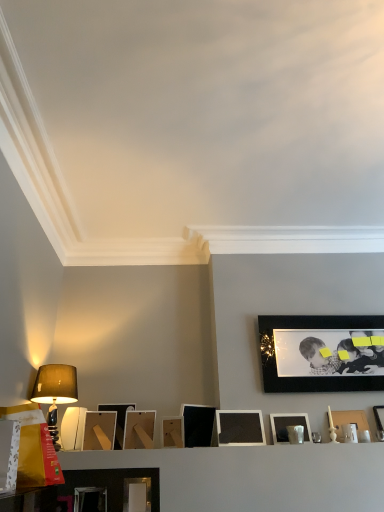
What is the approximate width of matte black picture frame at center, the 6th picture frame positioned from the right?

The width of matte black picture frame at center, the 6th picture frame positioned from the right, is 4.94 inches.

Describe the element at coordinates (198, 425) in the screenshot. I see `matte black picture frame at center, which is counted as the 8th picture frame, starting from the left` at that location.

The image size is (384, 512). What do you see at coordinates (379, 421) in the screenshot?
I see `matte black picture frame at right, which ranks as the 13th picture frame in left-to-right order` at bounding box center [379, 421].

The image size is (384, 512). What are the coordinates of `matte black picture frame at center, which ranks as the fourth picture frame in right-to-left order` in the screenshot? It's located at (288, 425).

Identify the location of black matte picture frame at upper right, the 11th picture frame in the left-to-right sequence. (319, 354).

Identify the location of matte brown picture frame at lower center, which is the third picture frame from left to right. (99, 430).

You are a GUI agent. You are given a task and a screenshot of the screen. Output one action in this format:
    pyautogui.click(x=<x>, y=<y>)
    Task: Click on the white matte picture frame at center, the fifth picture frame viewed from the right
    This screenshot has width=384, height=512.
    Given the screenshot: What is the action you would take?
    pyautogui.click(x=240, y=428)

The height and width of the screenshot is (512, 384). Describe the element at coordinates (240, 428) in the screenshot. I see `white matte picture frame at center, the fifth picture frame viewed from the right` at that location.

Find the location of a particular element. matte black picture frame at center, the 6th picture frame positioned from the right is located at coordinates (198, 425).

Is matte black picture frame at lower center, marked as the 2th picture frame in a left-to-right arrangement, situated inside matte white picture frame at right, placed as the 12th picture frame when sorted from left to right, or outside?

The correct answer is: outside.

In the scene shown: Could you tell me if matte black picture frame at lower center, which is the twelfth picture frame in right-to-left order, is facing matte white picture frame at right, the second picture frame from the right?

No, matte black picture frame at lower center, which is the twelfth picture frame in right-to-left order, does not turn towards matte white picture frame at right, the second picture frame from the right.

Does matte black picture frame at lower center, which is the twelfth picture frame in right-to-left order, lie in front of matte white picture frame at right, placed as the 12th picture frame when sorted from left to right?

Yes, it is in front of matte white picture frame at right, placed as the 12th picture frame when sorted from left to right.

Considering the sizes of objects matte black picture frame at lower center, which is the twelfth picture frame in right-to-left order, and matte white picture frame at right, placed as the 12th picture frame when sorted from left to right, in the image provided, who is smaller, matte black picture frame at lower center, which is the twelfth picture frame in right-to-left order, or matte white picture frame at right, placed as the 12th picture frame when sorted from left to right,?

Smaller between the two is matte black picture frame at lower center, which is the twelfth picture frame in right-to-left order.

From the image's perspective, who appears lower, matte wooden picture frame at center, which is the 9th picture frame from right to left, or matte silver picture frame at lower center, the eighth picture frame from the right?

From the image's view, matte silver picture frame at lower center, the eighth picture frame from the right, is below.

Could you tell me if matte wooden picture frame at center, which ranks as the fifth picture frame in left-to-right order, is facing matte silver picture frame at lower center, which ranks as the 6th picture frame in left-to-right order?

No, matte wooden picture frame at center, which ranks as the fifth picture frame in left-to-right order, is not turned towards matte silver picture frame at lower center, which ranks as the 6th picture frame in left-to-right order.

Between matte wooden picture frame at center, which ranks as the fifth picture frame in left-to-right order, and matte silver picture frame at lower center, the eighth picture frame from the right, which one has larger size?

matte wooden picture frame at center, which ranks as the fifth picture frame in left-to-right order, is bigger.

In the scene shown: Which is nearer, [132,442] or [127,510]?

Point [127,510]

From the image's perspective, is black matte picture frame at upper right, the 11th picture frame in the left-to-right sequence, beneath matte wooden picture frame at center, which ranks as the fifth picture frame in left-to-right order?

No.

From a real-world perspective, is black matte picture frame at upper right, the 11th picture frame in the left-to-right sequence, above or below matte wooden picture frame at center, which ranks as the fifth picture frame in left-to-right order?

black matte picture frame at upper right, the 11th picture frame in the left-to-right sequence, is above matte wooden picture frame at center, which ranks as the fifth picture frame in left-to-right order.

Looking at this image, is the surface of black matte picture frame at upper right, the 11th picture frame in the left-to-right sequence, in direct contact with matte wooden picture frame at center, which ranks as the fifth picture frame in left-to-right order?

They are not placed beside each other.

Between black matte picture frame at upper right, arranged as the 3th picture frame when viewed from the right, and matte wooden picture frame at center, which ranks as the fifth picture frame in left-to-right order, which one appears on the left side from the viewer's perspective?

From the viewer's perspective, matte wooden picture frame at center, which ranks as the fifth picture frame in left-to-right order, appears more on the left side.

Is matte wooden picture frame at center, which ranks as the fifth picture frame in left-to-right order, facing towards white matte picture frame at center, the fourth picture frame positioned from the left?

Yes, matte wooden picture frame at center, which ranks as the fifth picture frame in left-to-right order, is oriented towards white matte picture frame at center, the fourth picture frame positioned from the left.

Considering the relative sizes of matte wooden picture frame at center, which is the 9th picture frame from right to left, and white matte picture frame at center, the tenth picture frame in the right-to-left sequence, in the image provided, is matte wooden picture frame at center, which is the 9th picture frame from right to left, shorter than white matte picture frame at center, the tenth picture frame in the right-to-left sequence,?

Yes.

Which object is more forward, matte wooden picture frame at center, which is the 9th picture frame from right to left, or white matte picture frame at center, the tenth picture frame in the right-to-left sequence?

matte wooden picture frame at center, which is the 9th picture frame from right to left, is closer to the camera.

Between point (380, 365) and point (340, 418), which one is positioned in front?

The point (340, 418) is closer to the camera.

From a real-world perspective, count 8th picture frames upward from the matte white picture frame at right, placed as the 12th picture frame when sorted from left to right, and point to it. Please provide its 2D coordinates.

[(319, 354)]

Does black matte picture frame at upper right, the 11th picture frame in the left-to-right sequence, have a greater width compared to matte white picture frame at right, placed as the 12th picture frame when sorted from left to right?

No.

Does matte brown picture frame at lower center, which appears as the 11th picture frame when viewed from the right, lie in front of matte black picture frame at lower center, marked as the 2th picture frame in a left-to-right arrangement?

No.

Considering the sizes of matte brown picture frame at lower center, which appears as the 11th picture frame when viewed from the right, and matte black picture frame at lower center, which is the twelfth picture frame in right-to-left order, in the image, is matte brown picture frame at lower center, which appears as the 11th picture frame when viewed from the right, wider or thinner than matte black picture frame at lower center, which is the twelfth picture frame in right-to-left order,?

Clearly, matte brown picture frame at lower center, which appears as the 11th picture frame when viewed from the right, has more width compared to matte black picture frame at lower center, which is the twelfth picture frame in right-to-left order.

Is matte brown picture frame at lower center, which appears as the 11th picture frame when viewed from the right, taller than matte black picture frame at lower center, marked as the 2th picture frame in a left-to-right arrangement?

Indeed, matte brown picture frame at lower center, which appears as the 11th picture frame when viewed from the right, has a greater height compared to matte black picture frame at lower center, marked as the 2th picture frame in a left-to-right arrangement.

From the matte brown picture frame at lower center, which appears as the 11th picture frame when viewed from the right, count the 1st picture frame to the left and point to it. Please provide its 2D coordinates.

[(90, 499)]

From the image's perspective, is matte black picture frame at center, which ranks as the fourth picture frame in right-to-left order, located above matte brown lampshade at left?

Actually, matte black picture frame at center, which ranks as the fourth picture frame in right-to-left order, appears below matte brown lampshade at left in the image.

From a real-world perspective, is matte black picture frame at center, which ranks as the fourth picture frame in right-to-left order, below matte brown lampshade at left?

Correct, in the physical world, matte black picture frame at center, which ranks as the fourth picture frame in right-to-left order, is lower than matte brown lampshade at left.

From the image's perspective, which picture frame is the 8th one below the matte brown lampshade at left? Please provide its 2D coordinates.

[(288, 425)]

Where is `the 10th picture frame to the right of the matte black picture frame at lower center, marked as the 2th picture frame in a left-to-right arrangement, starting your count from the anchor`? This screenshot has width=384, height=512. the 10th picture frame to the right of the matte black picture frame at lower center, marked as the 2th picture frame in a left-to-right arrangement, starting your count from the anchor is located at coordinates (349, 420).

From the image's perspective, count 8th picture frames downward from the matte wooden picture frame at center, which ranks as the fifth picture frame in left-to-right order, and point to it. Please provide its 2D coordinates.

[(137, 495)]

From the image, which object appears to be nearer to matte brown picture frame at lower center, which is the third picture frame from left to right, matte wooden picture frame at center, which ranks as the fifth picture frame in left-to-right order, or matte white picture frame at right, placed as the 12th picture frame when sorted from left to right?

matte wooden picture frame at center, which ranks as the fifth picture frame in left-to-right order.

Looking at the image, which one is located further to matte black picture frame at left, which is counted as the 13th picture frame, starting from the right, matte wooden picture frame at center, which is the 9th picture frame from right to left, or white matte picture frame at center, the ninth picture frame positioned from the left?

Among the two, white matte picture frame at center, the ninth picture frame positioned from the left, is located further to matte black picture frame at left, which is counted as the 13th picture frame, starting from the right.

Considering their positions, is matte brown lampshade at left positioned further to white matte picture frame at center, the fourth picture frame positioned from the left, than matte black picture frame at left, acting as the 1th picture frame starting from the left?

matte brown lampshade at left.

Considering their positions, is matte black picture frame at right, the first picture frame from the right, positioned closer to matte silver picture frame at lower center, the eighth picture frame from the right, than matte black picture frame at left, acting as the 1th picture frame starting from the left?

matte black picture frame at left, acting as the 1th picture frame starting from the left.

When comparing their distances from matte black picture frame at left, which is counted as the 13th picture frame, starting from the right, does black matte picture frame at upper right, arranged as the 3th picture frame when viewed from the right, or matte black picture frame at center, which is counted as the 8th picture frame, starting from the left, seem further?

Among the two, black matte picture frame at upper right, arranged as the 3th picture frame when viewed from the right, is located further to matte black picture frame at left, which is counted as the 13th picture frame, starting from the right.

Which object lies further to the anchor point matte wooden picture frame at center, which is the 9th picture frame from right to left, matte brown lampshade at left or matte black picture frame at center, which ranks as the fourth picture frame in right-to-left order?

matte black picture frame at center, which ranks as the fourth picture frame in right-to-left order.

Looking at the image, which one is located closer to matte wooden picture frame at center, which ranks as the fifth picture frame in left-to-right order, matte black picture frame at lower center, which is the twelfth picture frame in right-to-left order, or matte black picture frame at center, the 6th picture frame positioned from the right?

Based on the image, matte black picture frame at center, the 6th picture frame positioned from the right, appears to be nearer to matte wooden picture frame at center, which ranks as the fifth picture frame in left-to-right order.

Considering their positions, is matte black picture frame at center, which ranks as the fourth picture frame in right-to-left order, positioned further to matte wooden picture frame at center, which ranks as the fifth picture frame in left-to-right order, than matte black picture frame at left, which is counted as the 13th picture frame, starting from the right?

Based on the image, matte black picture frame at center, which ranks as the fourth picture frame in right-to-left order, appears to be further to matte wooden picture frame at center, which ranks as the fifth picture frame in left-to-right order.

The height and width of the screenshot is (512, 384). In order to click on picture frame between matte brown picture frame at lower center, which appears as the 11th picture frame when viewed from the right, and matte wooden picture frame at center, which is the 9th picture frame from right to left, from left to right in this screenshot , I will do [x=118, y=420].

I want to click on picture frame located between matte silver picture frame at lower center, the eighth picture frame from the right, and matte black picture frame at center, the 6th picture frame positioned from the right, in the left-right direction, so click(173, 432).

You are a GUI agent. You are given a task and a screenshot of the screen. Output one action in this format:
    pyautogui.click(x=<x>, y=<y>)
    Task: Click on the picture frame situated between white matte picture frame at center, the ninth picture frame positioned from the left, and black matte picture frame at upper right, arranged as the 3th picture frame when viewed from the right, from left to right
    
    Given the screenshot: What is the action you would take?
    pyautogui.click(x=288, y=425)

Where is `picture frame located between matte black picture frame at center, the 6th picture frame positioned from the right, and matte black picture frame at center, which ranks as the fourth picture frame in right-to-left order, in the left-right direction`? The width and height of the screenshot is (384, 512). picture frame located between matte black picture frame at center, the 6th picture frame positioned from the right, and matte black picture frame at center, which ranks as the fourth picture frame in right-to-left order, in the left-right direction is located at coordinates (240, 428).